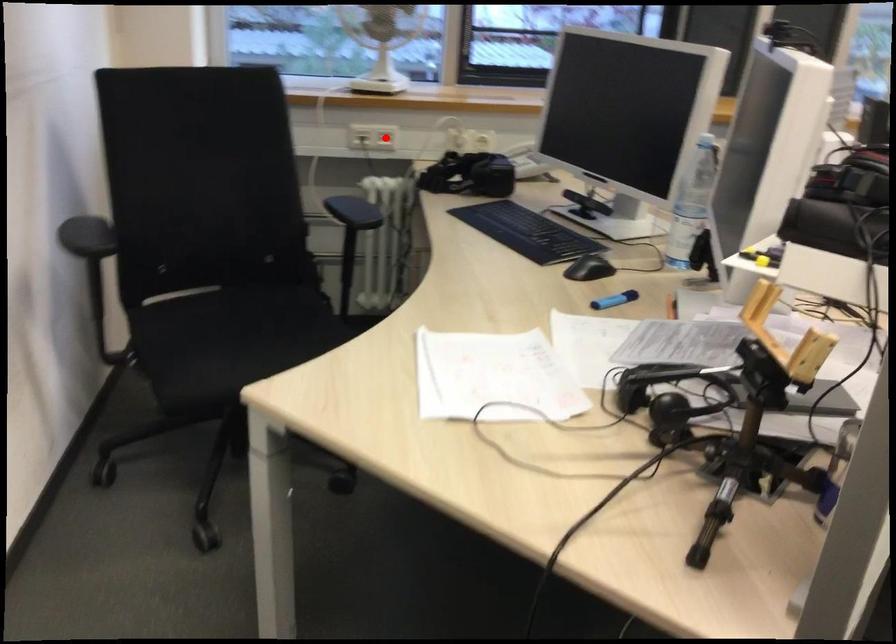
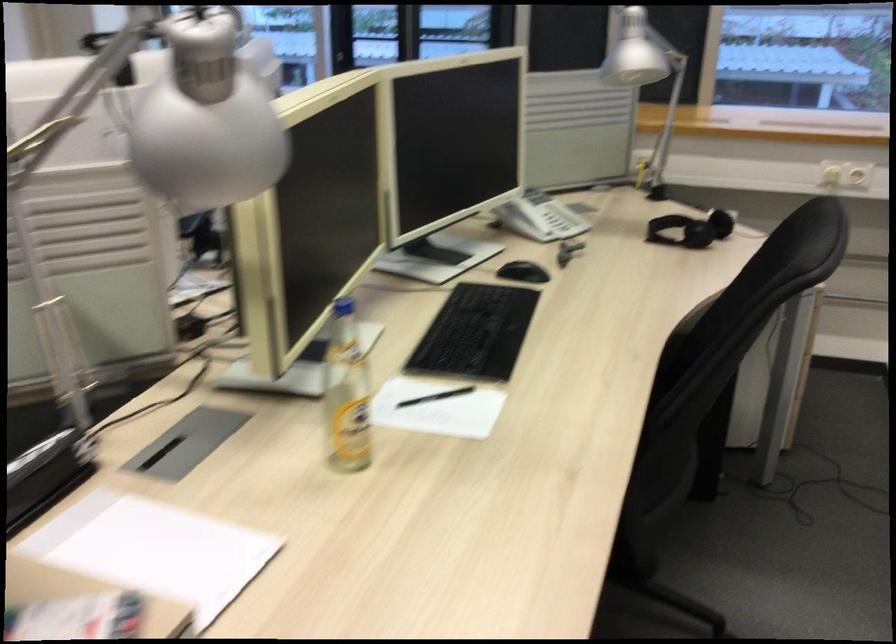
Question: I am providing you with two images of the same scene from different viewpoints. A red point is marked on the first image. At the location where the point appears in image 1, is it still visible in image 2?

Choices:
 (A) Yes
 (B) No

Answer: (B)